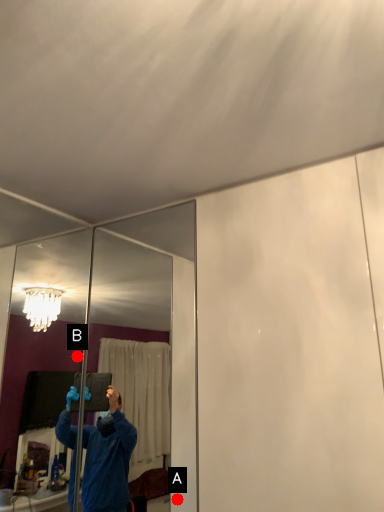
Question: Two points are circled on the image, labeled by A and B beside each circle. Which point is farther from the camera taking this photo?

Choices:
 (A) A is further
 (B) B is further

Answer: (B)